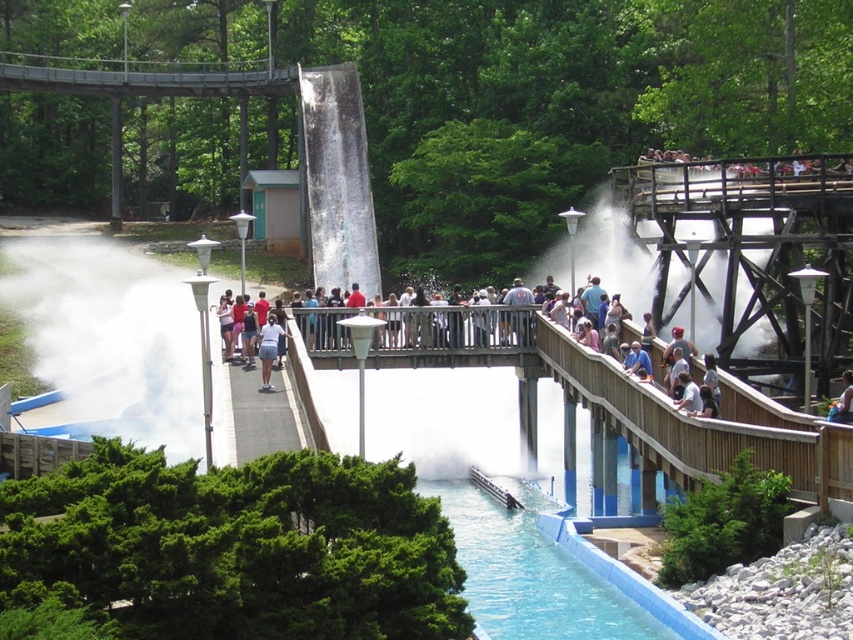
You are a park visitor standing on the wooden walkway. You notice the white mist at center and the white matte water at upper center. Which of these two elements is bigger in size?

The white mist at center is larger in size compared to the white matte water at upper center.

You are standing on the wooden walkway and want to take a photo of the white mist at center. According to the scene description, where should you position yourself to capture the mist in your shot?

The white mist at center is located at point (111,337), so you should position yourself at the wooden walkway near the center to capture the mist in your photo.

From the picture: You are a visitor standing on the wooden walkway and notice the white matte water at upper center and the blue denim shorts at upper center. Which object is located above the other?

The white matte water at upper center is positioned over blue denim shorts at upper center, so it is above the blue denim shorts at upper center.